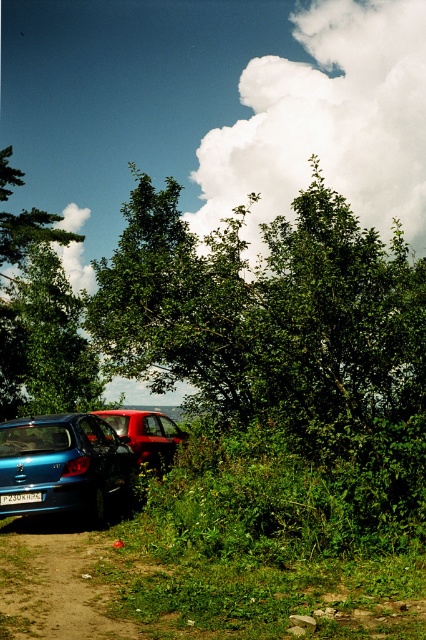
Identify the location of brown dirt track at lower left. This screenshot has height=640, width=426. (55, 584).

Find the location of `brown dirt track at lower left`. brown dirt track at lower left is located at coordinates (55, 584).

Describe the element at coordinates (265, 316) in the screenshot. I see `green leafy tree at center` at that location.

Who is more forward, (241, 326) or (20, 500)?

Point (20, 500) is more forward.

You are a GUI agent. You are given a task and a screenshot of the screen. Output one action in this format:
    pyautogui.click(x=<x>, y=<y>)
    Task: Click on the green leafy tree at center
    Image resolution: width=426 pixels, height=640 pixels.
    Given the screenshot: What is the action you would take?
    pyautogui.click(x=265, y=316)

Identify the location of green leafy tree at center. (265, 316).

This screenshot has width=426, height=640. What do you see at coordinates (265, 316) in the screenshot?
I see `green leafy tree at center` at bounding box center [265, 316].

Can you confirm if green leafy tree at center is thinner than metallic blue sedan at lower left?

In fact, green leafy tree at center might be wider than metallic blue sedan at lower left.

Find the location of a particular element. green leafy tree at center is located at coordinates (265, 316).